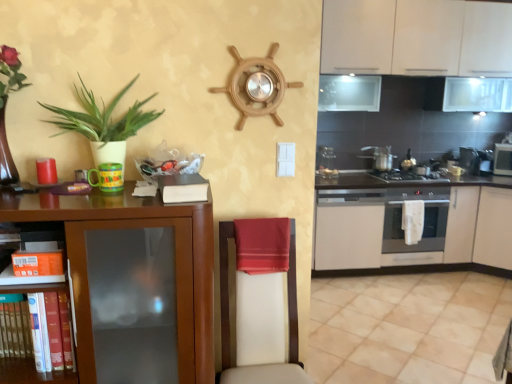
Question: Does metallic silver gas stove at center have a smaller size compared to stainless steel oven at right, the 5th appliance when ordered from left to right?

Choices:
 (A) no
 (B) yes

Answer: (A)

Question: Is metallic silver gas stove at center to the left of stainless steel oven at right, arranged as the second appliance when viewed from the right, from the viewer's perspective?

Choices:
 (A) yes
 (B) no

Answer: (A)

Question: Is metallic silver gas stove at center next to stainless steel oven at right, the 5th appliance when ordered from left to right?

Choices:
 (A) no
 (B) yes

Answer: (A)

Question: Does metallic silver gas stove at center have a lesser width compared to stainless steel oven at right, the 5th appliance when ordered from left to right?

Choices:
 (A) no
 (B) yes

Answer: (A)

Question: Does metallic silver gas stove at center turn towards stainless steel oven at right, arranged as the fourth appliance when viewed from the front?

Choices:
 (A) no
 (B) yes

Answer: (A)

Question: Is orange cardboard box at lower left inside the boundaries of metallic silver gas stove at center, or outside?

Choices:
 (A) outside
 (B) inside

Answer: (A)

Question: Based on their sizes in the image, would you say orange cardboard box at lower left is bigger or smaller than metallic silver gas stove at center?

Choices:
 (A) small
 (B) big

Answer: (A)

Question: In terms of width, does orange cardboard box at lower left look wider or thinner when compared to metallic silver gas stove at center?

Choices:
 (A) thin
 (B) wide

Answer: (A)

Question: From a real-world perspective, is orange cardboard box at lower left positioned above or below metallic silver gas stove at center?

Choices:
 (A) below
 (B) above

Answer: (B)

Question: Is white matte cabinet at lower right, which appears as the 4th cabinetry when viewed from the front, to the left or to the right of stainless steel oven at right, the 5th appliance when ordered from left to right, in the image?

Choices:
 (A) right
 (B) left

Answer: (B)

Question: Considering the positions of point (374, 261) and point (482, 153), is point (374, 261) closer or farther from the camera than point (482, 153)?

Choices:
 (A) closer
 (B) farther

Answer: (A)

Question: Is white matte cabinet at lower right, positioned as the 1th cabinetry in back-to-front order, spatially inside stainless steel oven at right, arranged as the fourth appliance when viewed from the front, or outside of it?

Choices:
 (A) inside
 (B) outside

Answer: (B)

Question: In terms of width, does white matte cabinet at lower right, positioned as the 1th cabinetry in back-to-front order, look wider or thinner when compared to stainless steel oven at right, the 5th appliance when ordered from left to right?

Choices:
 (A) thin
 (B) wide

Answer: (B)

Question: Is white matte cabinet at lower right, which appears as the 4th cabinetry when viewed from the front, inside the boundaries of red satin towel at center, or outside?

Choices:
 (A) outside
 (B) inside

Answer: (A)

Question: Does point (343, 261) appear closer or farther from the camera than point (270, 263)?

Choices:
 (A) farther
 (B) closer

Answer: (A)